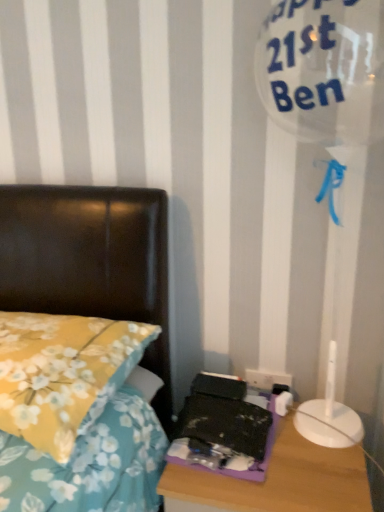
Question: Is purple plastic nightstand at lower right situated inside white plastic electric outlet at lower right or outside?

Choices:
 (A) outside
 (B) inside

Answer: (A)

Question: Considering their positions, is purple plastic nightstand at lower right located in front of or behind white plastic electric outlet at lower right?

Choices:
 (A) behind
 (B) front

Answer: (B)

Question: Which of these objects is positioned farthest from the white plastic electric outlet at lower right?

Choices:
 (A) purple plastic nightstand at lower right
 (B) yellow floral fabric pillow at left

Answer: (B)

Question: Which object is the closest to the yellow floral fabric pillow at left?

Choices:
 (A) purple plastic nightstand at lower right
 (B) white plastic electric outlet at lower right

Answer: (A)